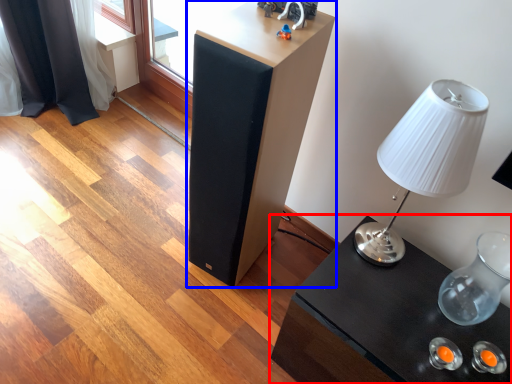
Question: Which object appears farthest to the camera in this image, table (highlighted by a red box) or furniture (highlighted by a blue box)?

Choices:
 (A) table
 (B) furniture

Answer: (B)